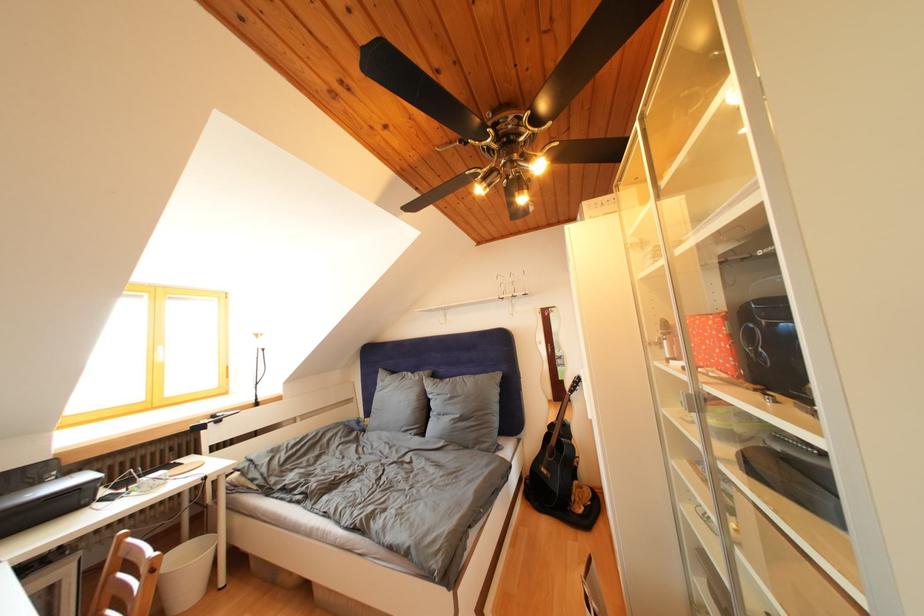
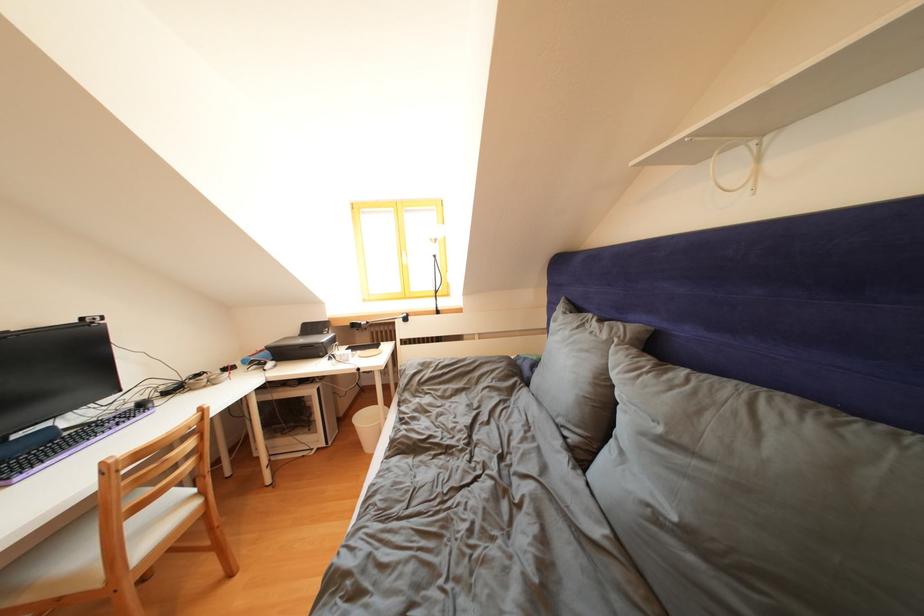
In the second image, find the point that corresponds to point 457,400 in the first image.

(667, 435)